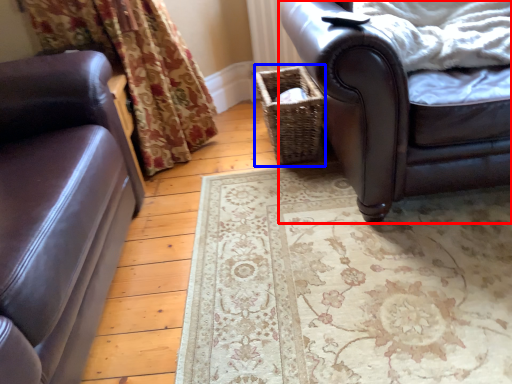
Question: Which object appears closest to the camera in this image, chair (highlighted by a red box) or basket (highlighted by a blue box)?

Choices:
 (A) chair
 (B) basket

Answer: (A)